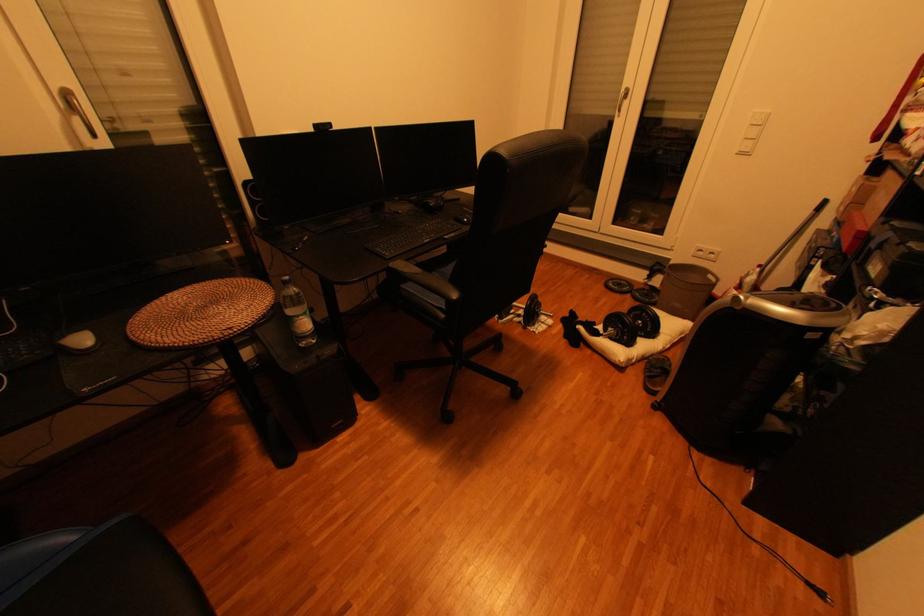
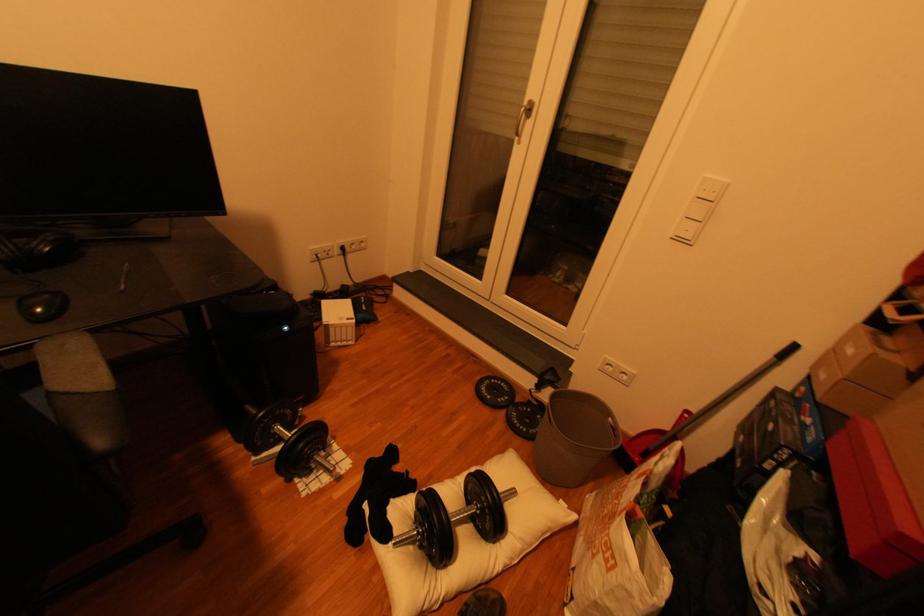
Find the pixel in the second image that matches [663,301] in the first image.

(543, 431)